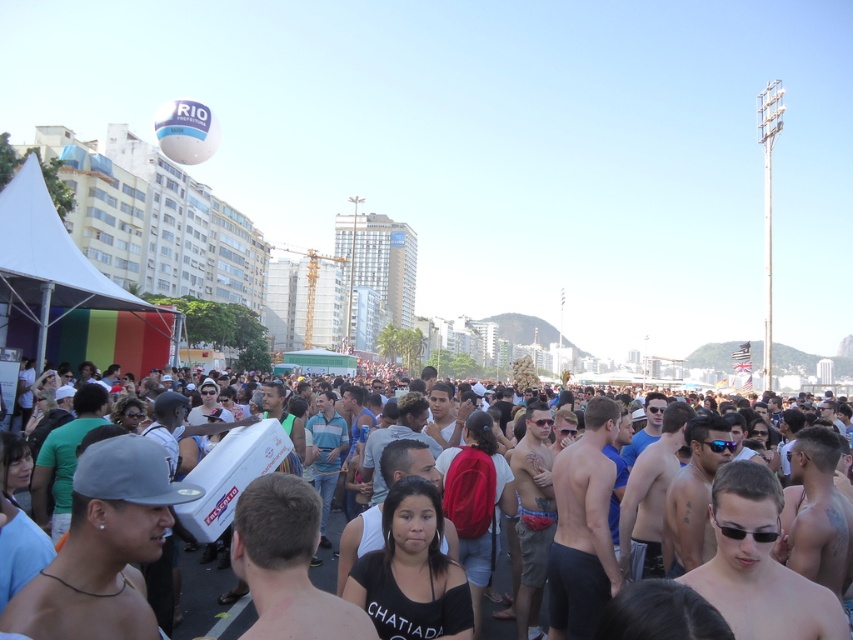
You are a photographer at the beach event and want to capture both the shiny skin at center and the white matte cooler at center in the same frame. Which object should you focus on first to ensure both are in the shot?

Since the shiny skin at center is smaller than the white matte cooler at center, you should focus on the white matte cooler at center first as it is larger and will be easier to frame, ensuring the smaller shiny skin at center also fits into the shot.

From the picture: You are standing at the beach event and want to take a photo of the two points mentioned. Which point, point (x=724, y=611) or point (x=190, y=568), is closer to your camera when you take the picture?

Point (x=724, y=611) is closer to the camera than point (x=190, y=568).

You are at the beach and see a point marked at coordinates (759,564). What is located at that point?

At point (759,564) lies shiny skin at center.